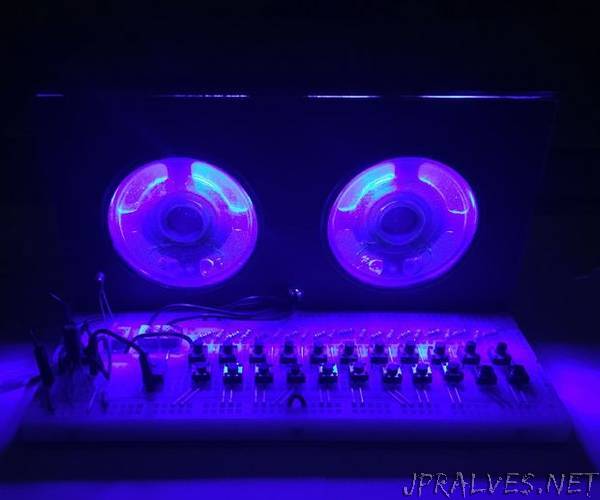
In order to click on synthesizer in this screenshot , I will do `click(341, 387)`.